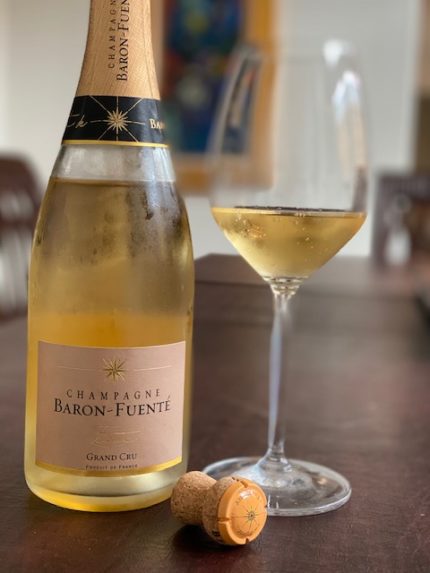
Where is `wine bottle`? wine bottle is located at coordinates (145, 313).